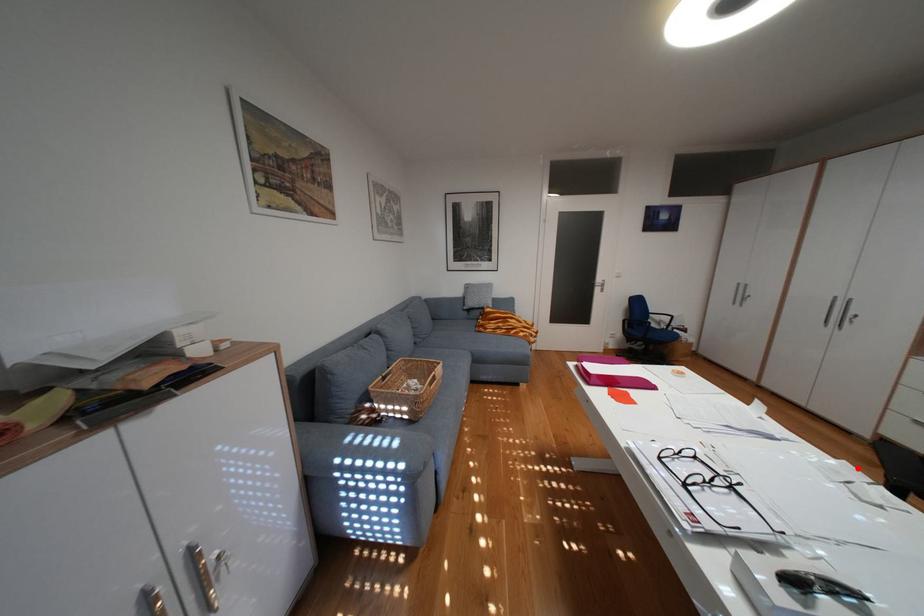
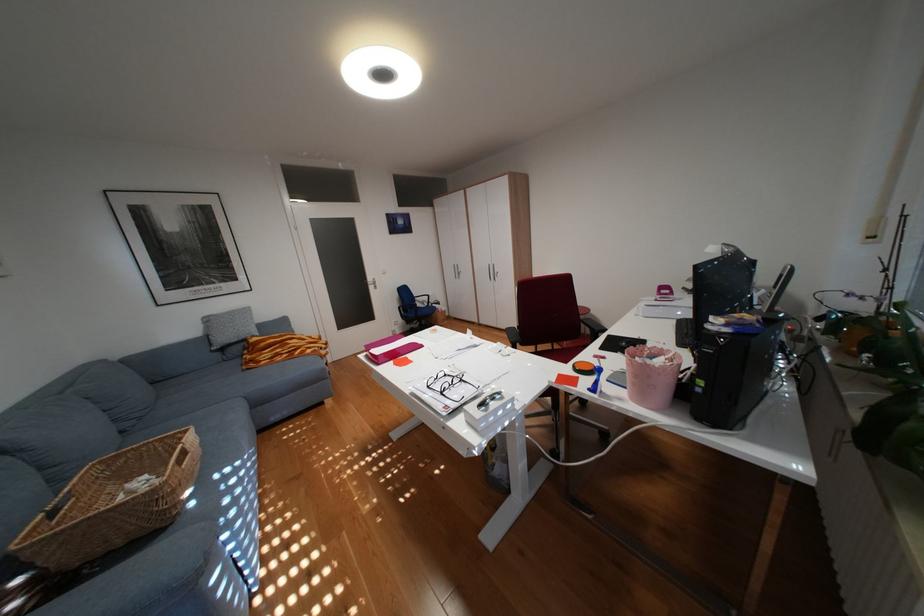
Find the pixel in the second image that matches the highlighted location in the first image.

(512, 345)